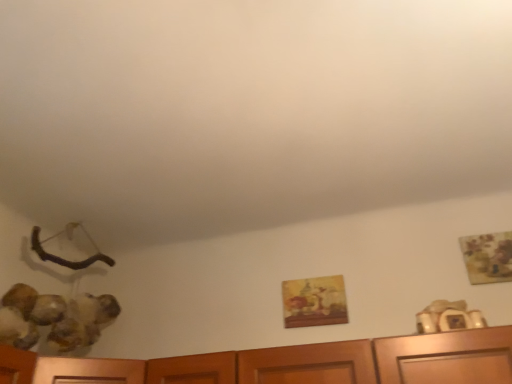
Question: Considering the relative positions of matte wooden picture frame at center, acting as the 2th picture frame starting from the front, and wooden painted picture frame at upper right, which is counted as the 1th picture frame, starting from the front, in the image provided, is matte wooden picture frame at center, acting as the 2th picture frame starting from the front, to the left of wooden painted picture frame at upper right, which is counted as the 1th picture frame, starting from the front, from the viewer's perspective?

Choices:
 (A) yes
 (B) no

Answer: (A)

Question: Is matte wooden picture frame at center, marked as the first picture frame in a left-to-right arrangement, not inside wooden painted picture frame at upper right, which is the 1th picture frame from right to left?

Choices:
 (A) no
 (B) yes

Answer: (B)

Question: Does matte wooden picture frame at center, acting as the 2th picture frame starting from the front, have a lesser width compared to wooden painted picture frame at upper right, which is counted as the 1th picture frame, starting from the front?

Choices:
 (A) yes
 (B) no

Answer: (B)

Question: Is matte wooden picture frame at center, acting as the 2th picture frame starting from the front, not close to wooden painted picture frame at upper right, the second picture frame viewed from the back?

Choices:
 (A) no
 (B) yes

Answer: (A)

Question: Can you confirm if matte wooden picture frame at center, placed as the 1th picture frame when sorted from back to front, is shorter than wooden painted picture frame at upper right, which is counted as the 1th picture frame, starting from the front?

Choices:
 (A) no
 (B) yes

Answer: (B)

Question: Can you confirm if matte wooden picture frame at center, positioned as the second picture frame in right-to-left order, is smaller than wooden painted picture frame at upper right, the first picture frame viewed from the top?

Choices:
 (A) no
 (B) yes

Answer: (A)

Question: Considering the relative positions of wooden painted picture frame at upper right, which is counted as the 1th picture frame, starting from the front, and matte wooden picture frame at center, acting as the 2th picture frame starting from the front, in the image provided, is wooden painted picture frame at upper right, which is counted as the 1th picture frame, starting from the front, to the left of matte wooden picture frame at center, acting as the 2th picture frame starting from the front, from the viewer's perspective?

Choices:
 (A) yes
 (B) no

Answer: (B)

Question: Does wooden painted picture frame at upper right, which is the 1th picture frame from right to left, have a lesser width compared to matte wooden picture frame at center, which is the 1th picture frame from bottom to top?

Choices:
 (A) no
 (B) yes

Answer: (B)

Question: Does wooden painted picture frame at upper right, the second picture frame positioned from the bottom, have a greater height compared to matte wooden picture frame at center, acting as the 2th picture frame starting from the front?

Choices:
 (A) yes
 (B) no

Answer: (A)

Question: Is wooden painted picture frame at upper right, the first picture frame viewed from the top, smaller than matte wooden picture frame at center, positioned as the second picture frame in right-to-left order?

Choices:
 (A) no
 (B) yes

Answer: (B)

Question: Is wooden painted picture frame at upper right, the second picture frame viewed from the back, surrounding matte wooden picture frame at center, which is the 1th picture frame from bottom to top?

Choices:
 (A) no
 (B) yes

Answer: (A)

Question: Can you confirm if wooden painted picture frame at upper right, which is counted as the 1th picture frame, starting from the front, is wider than matte wooden picture frame at center, positioned as the second picture frame in right-to-left order?

Choices:
 (A) yes
 (B) no

Answer: (B)

Question: Is point (335, 296) positioned closer to the camera than point (473, 264)?

Choices:
 (A) farther
 (B) closer

Answer: (A)